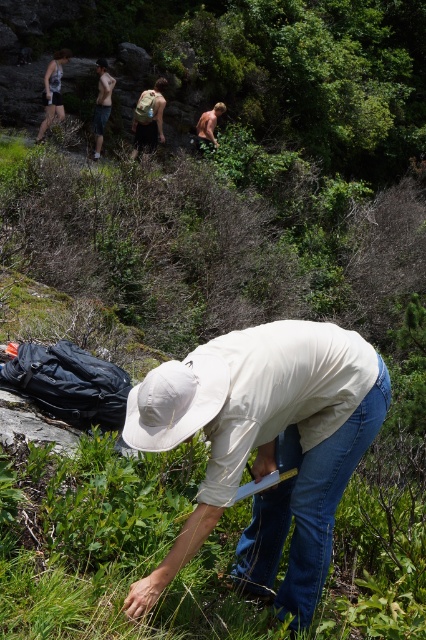
Measure the distance between point (154, 140) and camera.

The distance of point (154, 140) from camera is 15.95 meters.

Does light brown fur dog at upper center have a larger size compared to brown hairy man at upper center?

No, light brown fur dog at upper center is not bigger than brown hairy man at upper center.

Between point (149, 113) and point (207, 140), which one is positioned in front?

Positioned in front is point (149, 113).

At what (x,y) coordinates should I click in order to perform the action: click on light brown fur dog at upper center. Please return your answer as a coordinate pair (x, y). Looking at the image, I should click on (149, 116).

This screenshot has width=426, height=640. What do you see at coordinates (52, 92) in the screenshot? I see `silver metallic tank top at upper left` at bounding box center [52, 92].

Is silver metallic tank top at upper left bigger than tan skin torso at upper center?

Yes, silver metallic tank top at upper left is bigger than tan skin torso at upper center.

Image resolution: width=426 pixels, height=640 pixels. Describe the element at coordinates (52, 92) in the screenshot. I see `silver metallic tank top at upper left` at that location.

You are a GUI agent. You are given a task and a screenshot of the screen. Output one action in this format:
    pyautogui.click(x=<x>, y=<y>)
    Task: Click on the silver metallic tank top at upper left
    The image size is (426, 640).
    Given the screenshot: What is the action you would take?
    pyautogui.click(x=52, y=92)

Looking at this image, is light brown fur dog at upper center thinner than silver metallic tank top at upper left?

Incorrect, light brown fur dog at upper center's width is not less than silver metallic tank top at upper left's.

Between light brown fur dog at upper center and silver metallic tank top at upper left, which one is positioned higher?

Positioned higher is silver metallic tank top at upper left.

Measure the distance between light brown fur dog at upper center and camera.

The distance of light brown fur dog at upper center from camera is 15.55 meters.

Where is `light brown fur dog at upper center`? light brown fur dog at upper center is located at coordinates (149, 116).